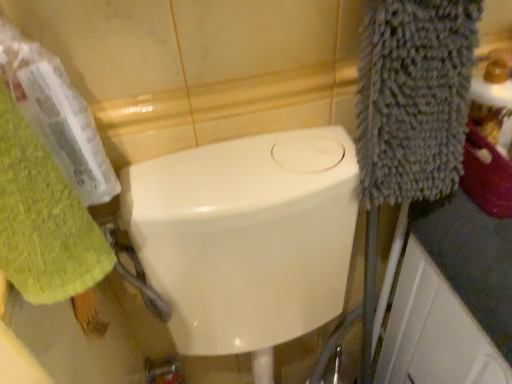
Question: Should I look upward or downward to see green textured towel at left?

Choices:
 (A) down
 (B) up

Answer: (B)

Question: Is green textured towel at left shorter than white glossy bidet at center?

Choices:
 (A) yes
 (B) no

Answer: (A)

Question: Is green textured towel at left positioned behind white glossy bidet at center?

Choices:
 (A) no
 (B) yes

Answer: (A)

Question: Is green textured towel at left thinner than white glossy bidet at center?

Choices:
 (A) yes
 (B) no

Answer: (A)

Question: From the image's perspective, is green textured towel at left beneath white glossy bidet at center?

Choices:
 (A) no
 (B) yes

Answer: (A)

Question: From a real-world perspective, is green textured towel at left beneath white glossy bidet at center?

Choices:
 (A) yes
 (B) no

Answer: (B)

Question: Could you tell me if green textured towel at left is facing white glossy bidet at center?

Choices:
 (A) yes
 (B) no

Answer: (B)

Question: Is white glossy bidet at center facing towards green textured towel at left?

Choices:
 (A) no
 (B) yes

Answer: (A)

Question: From a real-world perspective, is white glossy bidet at center on top of green textured towel at left?

Choices:
 (A) yes
 (B) no

Answer: (B)

Question: From the image's perspective, is white glossy bidet at center on green textured towel at left?

Choices:
 (A) no
 (B) yes

Answer: (A)

Question: Is white glossy bidet at center in front of green textured towel at left?

Choices:
 (A) yes
 (B) no

Answer: (B)

Question: Are white glossy bidet at center and green textured towel at left making contact?

Choices:
 (A) yes
 (B) no

Answer: (B)

Question: Is green textured towel at left inside white glossy bidet at center?

Choices:
 (A) yes
 (B) no

Answer: (B)

Question: Would you say green textured towel at left is inside or outside white glossy bidet at center?

Choices:
 (A) outside
 (B) inside

Answer: (A)